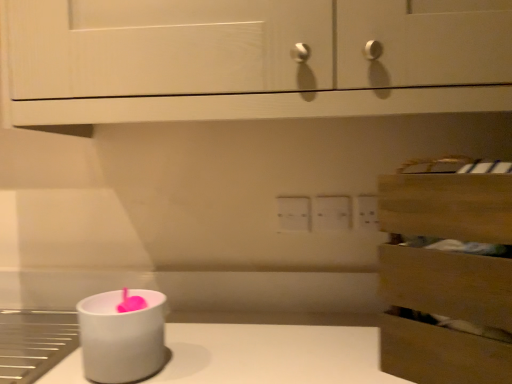
Question: From their relative heights in the image, would you say white wood cabinet at upper center is taller or shorter than white plastic electric outlet at center?

Choices:
 (A) short
 (B) tall

Answer: (B)

Question: Which is correct: white wood cabinet at upper center is inside white plastic electric outlet at center, or outside of it?

Choices:
 (A) outside
 (B) inside

Answer: (A)

Question: Estimate the real-world distances between objects in this image. Which object is closer to the white matte candle holder at lower left?

Choices:
 (A) white plastic electric outlet at center
 (B) white wood cabinet at upper center
 (C) wooden drawer at right

Answer: (B)

Question: Estimate the real-world distances between objects in this image. Which object is farther from the white matte candle holder at lower left?

Choices:
 (A) white wood cabinet at upper center
 (B) wooden drawer at right
 (C) white plastic electric outlet at center

Answer: (C)